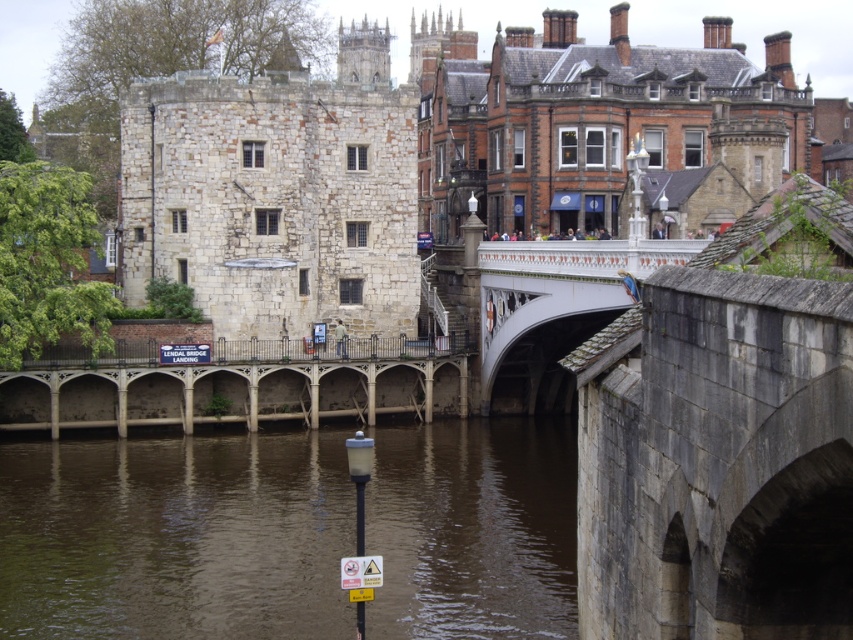
You are standing on the stone bridge and want to cross to the other side. You notice the stone castle at center and the stone arches at center. Which one is closer to your current position?

The stone arches at center are closer to your current position because the stone castle at center is located to the right of the stone arches at center, meaning the arches are between you and the castle.

You are standing on the stone bridge in the urban scene. You want to cross to the other side but need to know the distance to the brown water at lower center before proceeding. Can you safely step onto the bridge if the safe distance for stepping is 50 meters or less?

The brown water at lower center is 44.14 meters away from the viewer, which is within the safe distance of 50 meters. Therefore, you can safely step onto the bridge.

From the picture: You are a city planner assessing the space between the brown water at lower center and the white stone bridge at center. Which object occupies more area in the image?

The brown water at lower center has a larger size compared to the white stone bridge at center, so it occupies more area in the image.